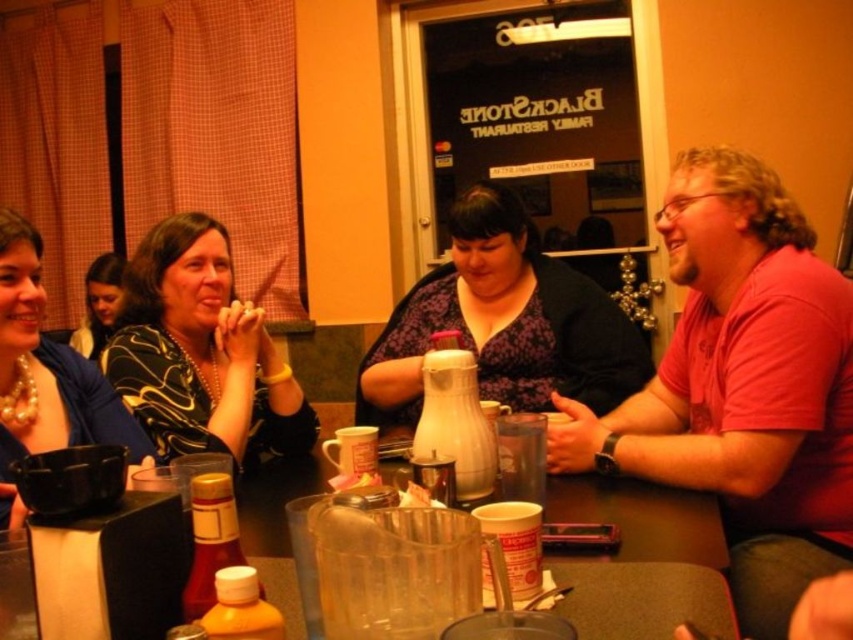
Question: Is black matte dress at center in front of white matte pitcher at center?

Choices:
 (A) yes
 (B) no

Answer: (B)

Question: Estimate the real-world distances between objects in this image. Which object is farther from the matte black shirt at upper left?

Choices:
 (A) yellow matte bottle at lower left
 (B) white matte pitcher at center
 (C) black matte dress at center

Answer: (A)

Question: Which object is the closest to the pearl necklace at left?

Choices:
 (A) white matte pitcher at center
 (B) matte black shirt at upper left

Answer: (A)

Question: Can you confirm if matte black shirt at center is positioned to the right of matte black shirt at upper left?

Choices:
 (A) yes
 (B) no

Answer: (A)

Question: Which point is farther from the camera taking this photo?

Choices:
 (A) (486, 182)
 (B) (244, 317)
 (C) (86, 337)

Answer: (C)

Question: Is matte black shirt at center to the left of matte black shirt at upper left from the viewer's perspective?

Choices:
 (A) no
 (B) yes

Answer: (A)